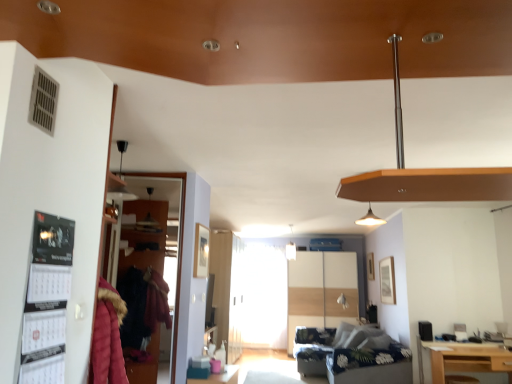
Question: Is the position of transparent glass door at left, arranged as the second glass door when ordered from the bottom, more distant than that of dark blue floral fabric couch at lower center?

Choices:
 (A) yes
 (B) no

Answer: (B)

Question: Is transparent glass door at left, arranged as the second glass door when ordered from the bottom, in contact with dark blue floral fabric couch at lower center?

Choices:
 (A) no
 (B) yes

Answer: (A)

Question: Is transparent glass door at left, which is the 1th glass door from front to back, to the right of dark blue floral fabric couch at lower center from the viewer's perspective?

Choices:
 (A) yes
 (B) no

Answer: (B)

Question: Does transparent glass door at left, arranged as the second glass door when ordered from the bottom, have a lesser width compared to dark blue floral fabric couch at lower center?

Choices:
 (A) no
 (B) yes

Answer: (B)

Question: Can you confirm if transparent glass door at left, which appears as the 1th glass door when viewed from the left, is taller than dark blue floral fabric couch at lower center?

Choices:
 (A) no
 (B) yes

Answer: (B)

Question: From the image's perspective, would you say transparent glass door at left, arranged as the second glass door when ordered from the bottom, is shown under dark blue floral fabric couch at lower center?

Choices:
 (A) yes
 (B) no

Answer: (B)

Question: Could you tell me if light brown wooden table at lower right is turned towards transparent glass door at left, placed as the second glass door when sorted from right to left?

Choices:
 (A) no
 (B) yes

Answer: (A)

Question: Is light brown wooden table at lower right located outside transparent glass door at left, which is the 1th glass door from front to back?

Choices:
 (A) no
 (B) yes

Answer: (B)

Question: Is light brown wooden table at lower right taller than transparent glass door at left, placed as the second glass door when sorted from right to left?

Choices:
 (A) no
 (B) yes

Answer: (A)

Question: Are light brown wooden table at lower right and transparent glass door at left, which appears as the 1th glass door when viewed from the left, making contact?

Choices:
 (A) yes
 (B) no

Answer: (B)

Question: Can you confirm if light brown wooden table at lower right is positioned to the right of transparent glass door at left, placed as the second glass door when sorted from right to left?

Choices:
 (A) no
 (B) yes

Answer: (B)

Question: Considering the relative sizes of light brown wooden table at lower right and transparent glass door at left, which appears as the 1th glass door when viewed from the left, in the image provided, is light brown wooden table at lower right smaller than transparent glass door at left, which appears as the 1th glass door when viewed from the left,?

Choices:
 (A) yes
 (B) no

Answer: (B)

Question: Could transparent glass door at left, which appears as the 1th glass door when viewed from the left, be considered to be inside black paper calendar at left?

Choices:
 (A) no
 (B) yes

Answer: (A)